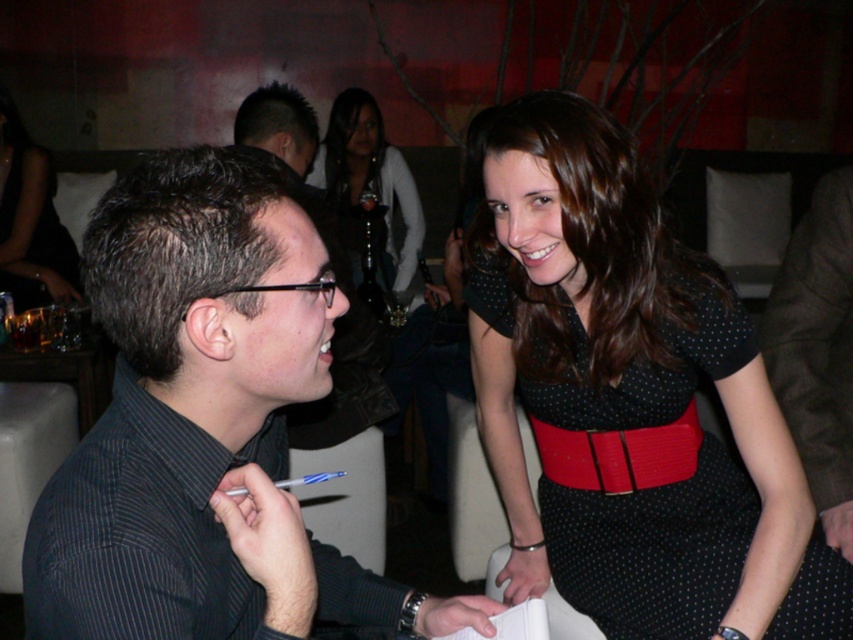
Looking at this image, you are standing in the scene and want to place a small decorative item exactly at the point marked as point (714, 332). If your hand is currently at 1.2 meters away from that point, can you reach it without moving your feet?

→ The distance of point (714, 332) from the viewer is 1.27 meters. Since your hand is at 1.2 meters away from the point, you are 0.07 meters too far to reach it without moving your feet.

You are standing at the point marked as point (421,604) in the image. If you want to take a photo of the scene, would you be able to capture the entire scene in one shot without moving your position?

The distance between you and the camera is 1.11 meters. Since you are at point (421,604), you can take a photo of the scene without moving as the distance allows the entire scene to be captured in one shot.

You are a photographer at a party and want to capture a photo of both the dark gray striped shirt at left and the black dotted fabric dress at upper right in the same frame. Based on their positions, which one should you focus on first to ensure both are in the frame?

The dark gray striped shirt at left is to the left of the black dotted fabric dress at upper right, so you should focus on the dark gray striped shirt at left first to ensure both are in the frame.